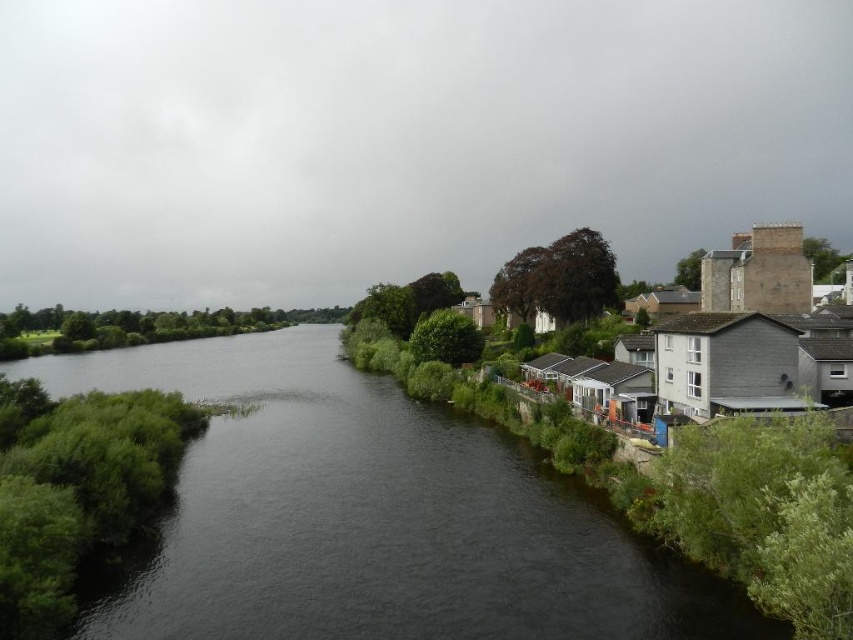
Based on the photo, you are a small boat operator who needs to navigate through the dark water at center. The safety regulations state that you must maintain a minimum distance of 50 meters from any structures. Are you compliant with the regulations when approaching the gray stone houses at right?

The distance between the dark water at center and the gray stone houses at right is 45.98 meters, which is less than the required 50 meters. Therefore, you are not compliant with the safety regulations.

You are standing at the riverside and want to reach a specific point marked at coordinates point (x=339, y=634). If your maximum comfortable walking distance is 30 meters, can you comfortably walk to that point?

The distance of point (x=339, y=634) from camera is 29.71 meters, so yes, you can comfortably walk to that point since it is within your 30 meters limit.